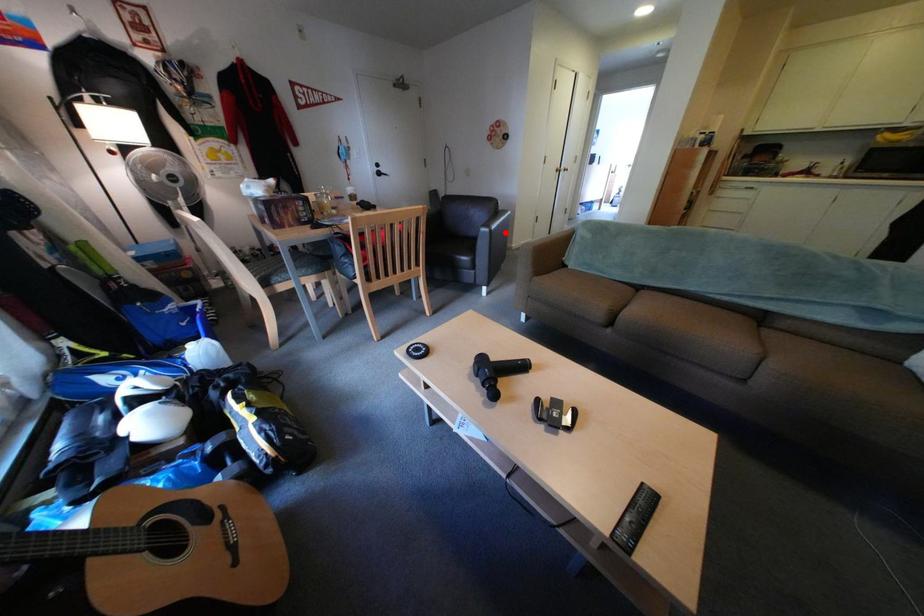
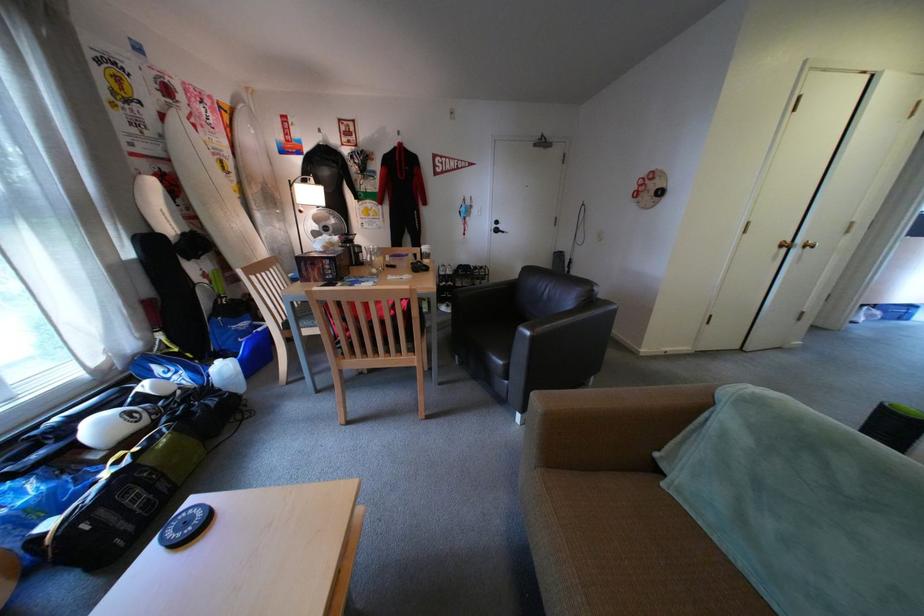
Locate, in the second image, the point that corresponds to the highlighted location in the first image.

(545, 339)